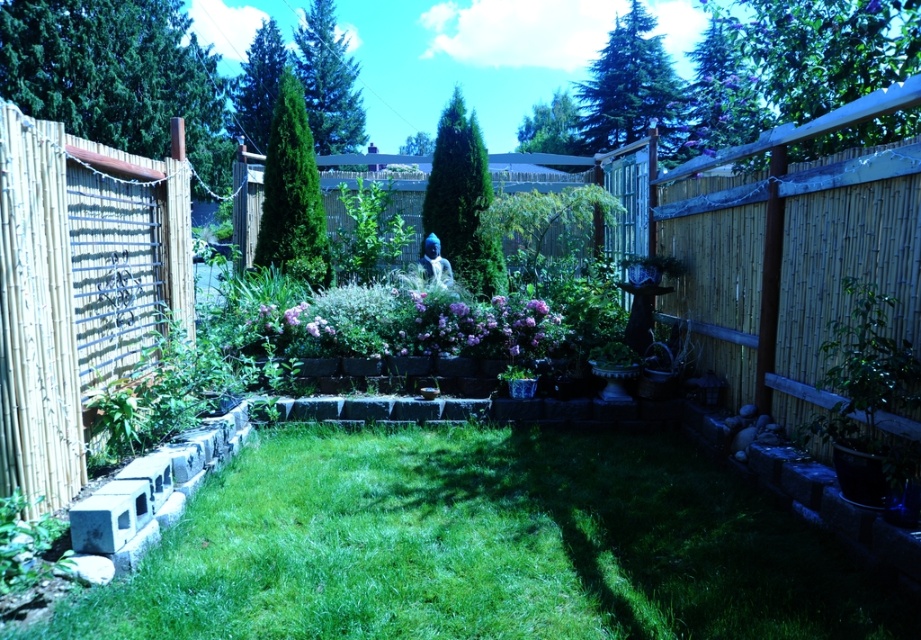
You are standing in the garden and want to take a photo of the green grass at center and the green leafy plant at lower left. Which object will appear closer to you in the photo?

The green grass at center will appear closer to you in the photo because it is in front of the green leafy plant at lower left.

You are standing at the edge of the lawn in the backyard garden scene. There is a point marked at coordinates (485, 547). What is the color of the object located at this point?

The point at coordinates (485, 547) corresponds to the green grass at center, which is green in color.

You are designing a garden layout and need to place a new decorative stone path. The path must be placed between the green grass at center and the green leafy plant at lower left. Which object should the path be closer to if it needs to accommodate a wider base?

The path should be closer to the green grass at center because its width surpasses that of the green leafy plant at lower left, allowing more space for the wider base.